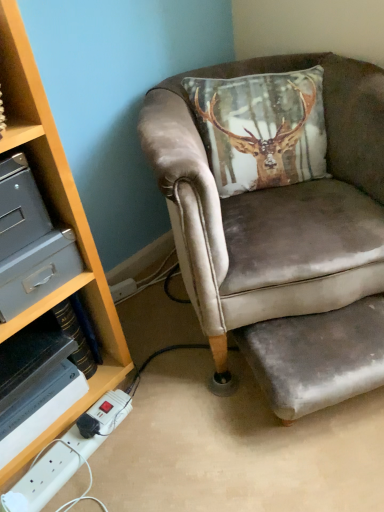
You are a GUI agent. You are given a task and a screenshot of the screen. Output one action in this format:
    pyautogui.click(x=<x>, y=<y>)
    Task: Click on the vacant space situated above velvet grey footrest at lower right (from a real-world perspective)
    This screenshot has width=384, height=512.
    Given the screenshot: What is the action you would take?
    pyautogui.click(x=327, y=328)